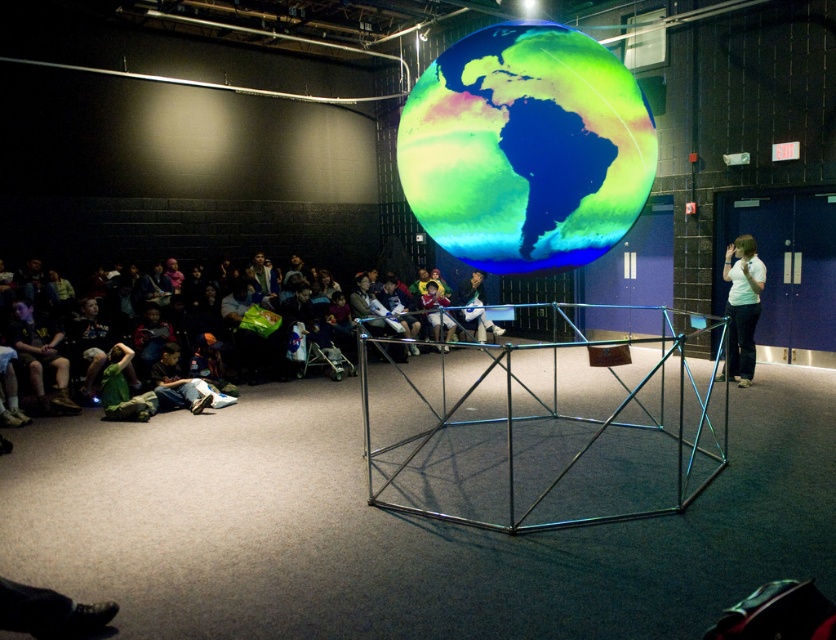
Question: Can you confirm if green fabric jacket at lower left is positioned below white shirt at right?

Choices:
 (A) no
 (B) yes

Answer: (B)

Question: Among these objects, which one is nearest to the camera?

Choices:
 (A) white shirt at right
 (B) translucent plastic globe at center
 (C) green fabric jacket at lower left

Answer: (B)

Question: Estimate the real-world distances between objects in this image. Which object is farther from the blue denim jeans at center?

Choices:
 (A) translucent plastic globe at center
 (B) green fabric jacket at lower left
 (C) white shirt at right

Answer: (A)

Question: Is green fabric jacket at lower left thinner than white shirt at right?

Choices:
 (A) yes
 (B) no

Answer: (B)

Question: Among these objects, which one is farthest from the camera?

Choices:
 (A) white shirt at right
 (B) blue denim jeans at center
 (C) translucent plastic globe at center

Answer: (B)

Question: Is white shirt at right smaller than blue denim jeans at center?

Choices:
 (A) no
 (B) yes

Answer: (B)